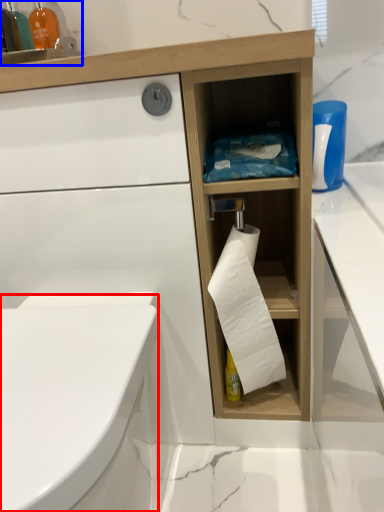
Question: Which of the following is the closest to the observer, bidet (highlighted by a red box) or cabinet (highlighted by a blue box)?

Choices:
 (A) bidet
 (B) cabinet

Answer: (A)